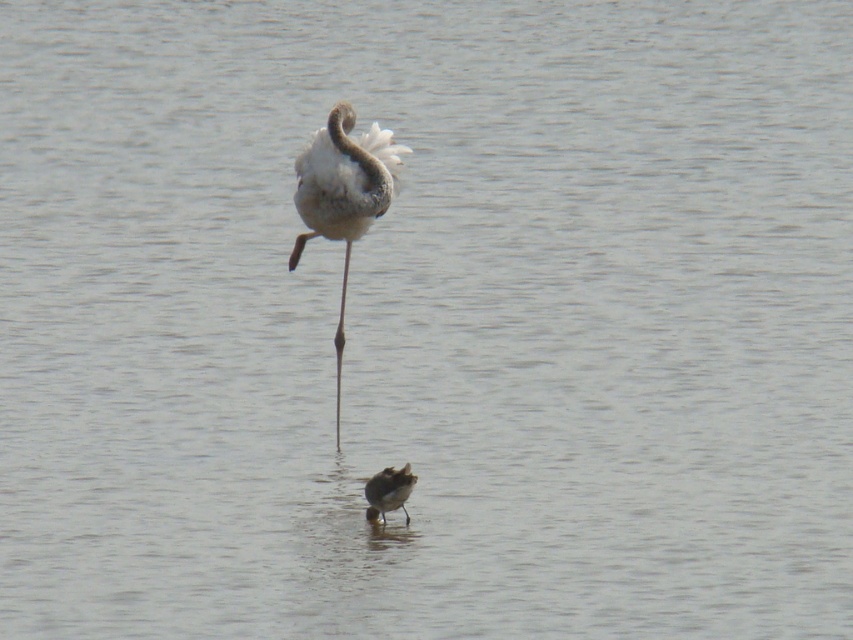
Is white feathered bird at center positioned behind brown speckled sandpiper at lower center?

Yes, it is behind brown speckled sandpiper at lower center.

Is white feathered bird at center closer to the viewer compared to brown speckled sandpiper at lower center?

No, white feathered bird at center is further to the viewer.

Is point (383, 172) farther from camera compared to point (393, 480)?

Yes, it is behind point (393, 480).

Locate an element on the screen. This screenshot has height=640, width=853. white feathered bird at center is located at coordinates (343, 195).